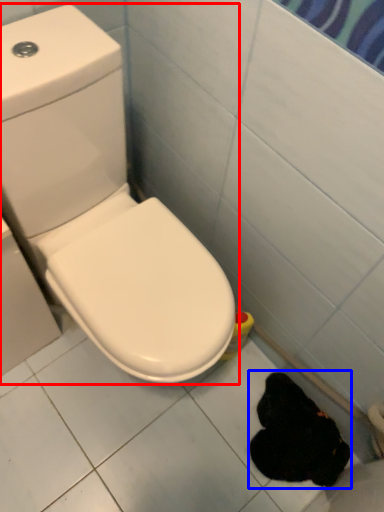
Question: Which of the following is the farthest to the observer, toilet (highlighted by a red box) or animal (highlighted by a blue box)?

Choices:
 (A) toilet
 (B) animal

Answer: (B)